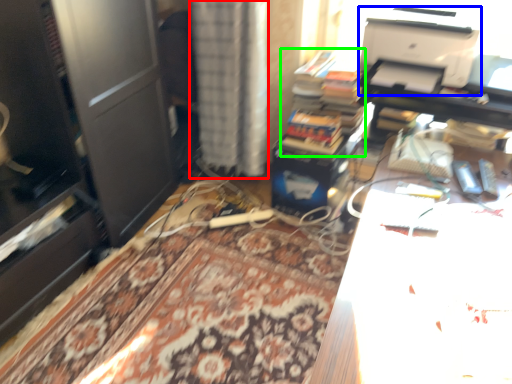
Question: Which is farther away from curtain (highlighted by a red box)? printer (highlighted by a blue box) or book (highlighted by a green box)?

Choices:
 (A) printer
 (B) book

Answer: (A)